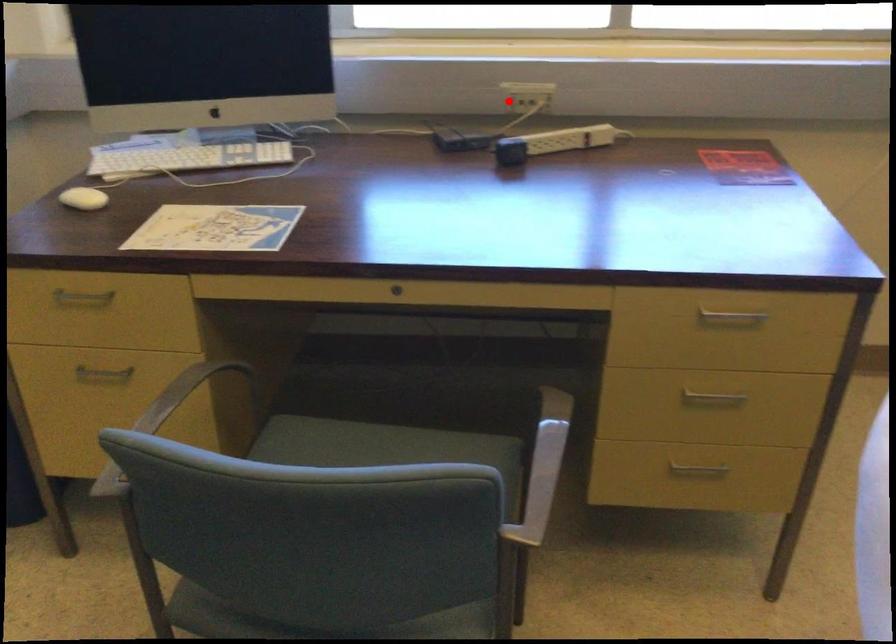
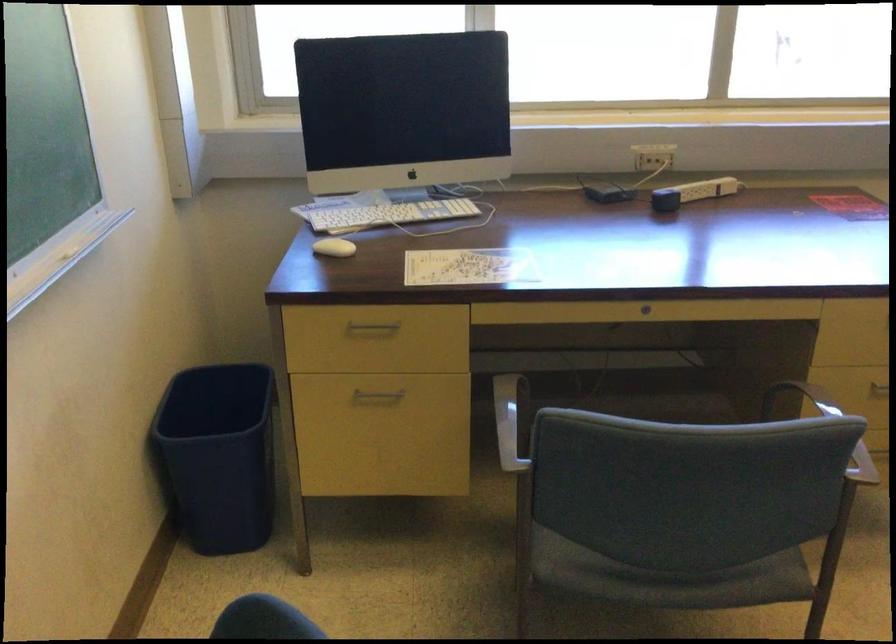
Where in the second image is the point corresponding to the highlighted location from the first image?

(643, 158)